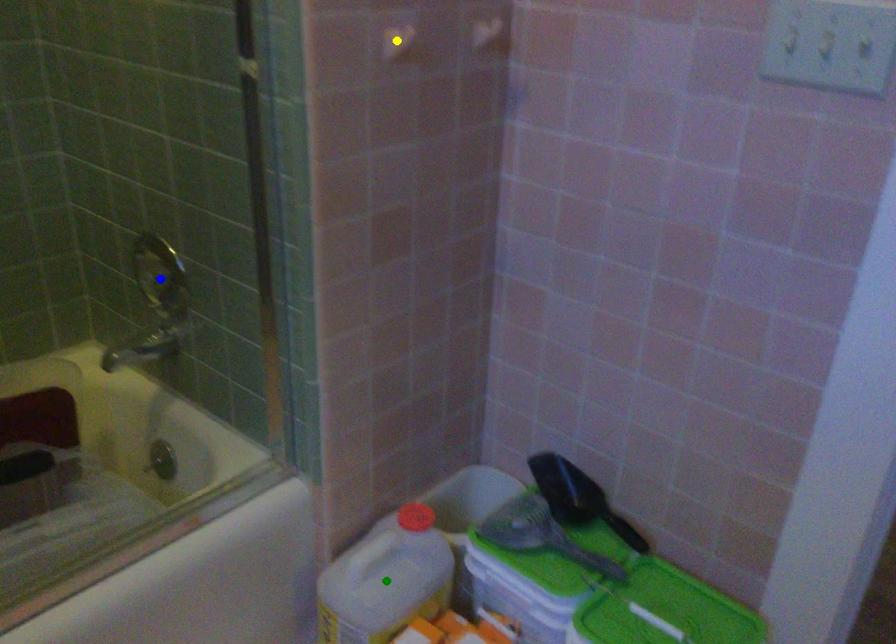
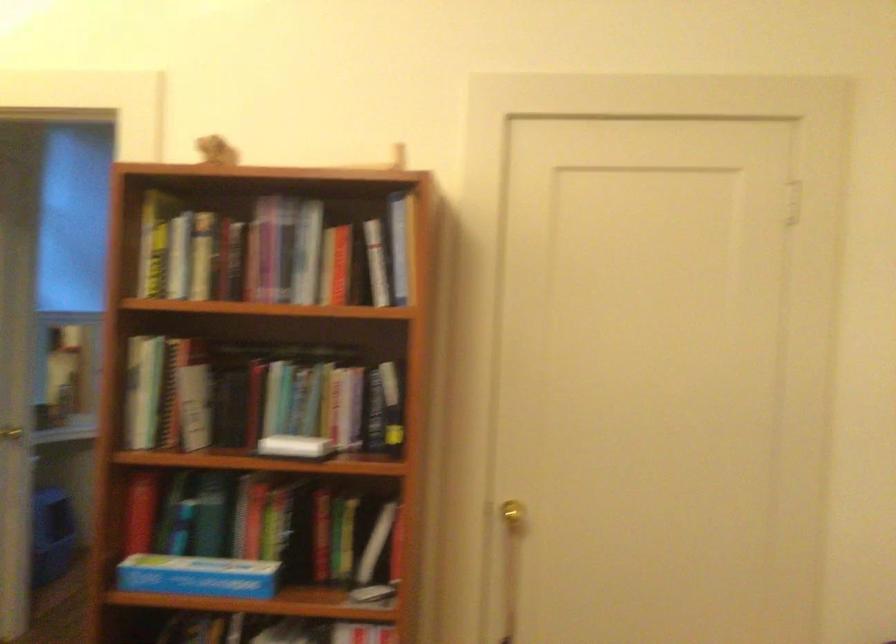
I am providing you with two images of the same scene from different viewpoints. Three points are marked in image1. Which point corresponds to a part or object that is occluded in image2?In image1, three points are marked. Which of them correspond to a part or object that is occluded in image2?Among the three points shown in image1, which one corresponds to a part or object that is no longer visible due to occlusion in image2?

Invisible in image2: blue point, green point, yellow point.